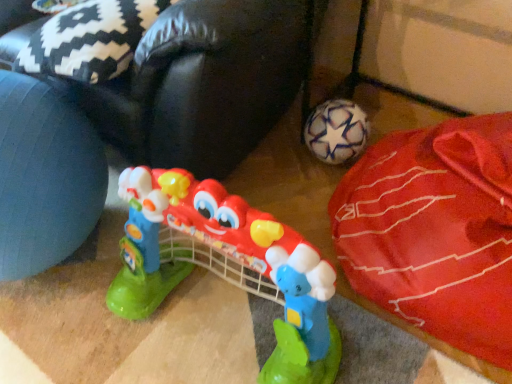
What do you see at coordinates (203, 84) in the screenshot? This screenshot has width=512, height=384. I see `red fabric bean bag at lower right` at bounding box center [203, 84].

Image resolution: width=512 pixels, height=384 pixels. Find the location of `plastic toy guitar at center`. plastic toy guitar at center is located at coordinates [226, 265].

Considering the relative sizes of red fabric bean bag at lower right and white matte soccer ball at lower right in the image provided, is red fabric bean bag at lower right thinner than white matte soccer ball at lower right?

No.

From the image's perspective, which is above, red fabric bean bag at lower right or white matte soccer ball at lower right?

red fabric bean bag at lower right appears higher in the image.

Considering their positions, is red fabric bean bag at lower right located in front of or behind white matte soccer ball at lower right?

Visually, red fabric bean bag at lower right is located behind white matte soccer ball at lower right.

From a real-world perspective, which is physically above, red fabric bean bag at lower right or white matte soccer ball at lower right?

From a 3D spatial view, red fabric bean bag at lower right is above.

The image size is (512, 384). I want to click on bean bag chair above the white matte soccer ball at lower right (from a real-world perspective), so click(203, 84).

Based on their sizes in the image, would you say white matte soccer ball at lower right is bigger or smaller than red fabric bean bag at lower right?

In the image, white matte soccer ball at lower right appears to be smaller than red fabric bean bag at lower right.

What's the angular difference between white matte soccer ball at lower right and red fabric bean bag at lower right's facing directions?

The angular difference between white matte soccer ball at lower right and red fabric bean bag at lower right is 1.96 degrees.

Considering the sizes of white matte soccer ball at lower right and red fabric bean bag at lower right in the image, is white matte soccer ball at lower right wider or thinner than red fabric bean bag at lower right?

Considering their sizes, white matte soccer ball at lower right looks slimmer than red fabric bean bag at lower right.

Based on the photo, from the image's perspective, does plastic toy guitar at center appear lower than red fabric bean bag at lower right?

Yes, from the image's perspective, plastic toy guitar at center is below red fabric bean bag at lower right.

Consider the image. Measure the distance between plastic toy guitar at center and red fabric bean bag at lower right.

plastic toy guitar at center is 13.63 inches from red fabric bean bag at lower right.

Considering the sizes of objects plastic toy guitar at center and red fabric bean bag at lower right in the image provided, who is bigger, plastic toy guitar at center or red fabric bean bag at lower right?

Bigger between the two is red fabric bean bag at lower right.

From a real-world perspective, between plastic toy guitar at center and red fabric bean bag at lower right, who is vertically higher?

red fabric bean bag at lower right, from a real-world perspective.

Is white matte soccer ball at lower right not inside plastic toy guitar at center?

Yes, white matte soccer ball at lower right is located beyond the bounds of plastic toy guitar at center.

Considering the relative sizes of white matte soccer ball at lower right and plastic toy guitar at center in the image provided, is white matte soccer ball at lower right bigger than plastic toy guitar at center?

Correct, white matte soccer ball at lower right is larger in size than plastic toy guitar at center.

Which is in front, white matte soccer ball at lower right or plastic toy guitar at center?

plastic toy guitar at center is more forward.

Between white matte soccer ball at lower right and plastic toy guitar at center, which one appears on the left side from the viewer's perspective?

plastic toy guitar at center.

Between red fabric bean bag at lower right and plastic toy guitar at center, which one appears on the right side from the viewer's perspective?

From the viewer's perspective, plastic toy guitar at center appears more on the right side.

Is point (234, 168) less distant than point (284, 248)?

No, it is not.

Where is `toy in front of the red fabric bean bag at lower right`? toy in front of the red fabric bean bag at lower right is located at coordinates (226, 265).

Is red fabric bean bag at lower right next to plastic toy guitar at center?

There is a gap between red fabric bean bag at lower right and plastic toy guitar at center.

Which of these two, plastic toy guitar at center or white matte soccer ball at lower right, is wider?

Wider between the two is white matte soccer ball at lower right.

Considering the sizes of objects plastic toy guitar at center and white matte soccer ball at lower right in the image provided, who is smaller, plastic toy guitar at center or white matte soccer ball at lower right?

plastic toy guitar at center.

Is plastic toy guitar at center positioned beyond the bounds of white matte soccer ball at lower right?

Yes.

This screenshot has width=512, height=384. I want to click on bean bag chair above the white matte soccer ball at lower right (from a real-world perspective), so click(203, 84).

Locate an element on the screen. material that is in front of the red fabric bean bag at lower right is located at coordinates (435, 231).

Which object lies further to the anchor point red fabric bean bag at lower right, white matte soccer ball at lower right or plastic toy guitar at center?

white matte soccer ball at lower right.

From the image, which object appears to be nearer to red fabric bean bag at lower right, plastic toy guitar at center or white matte soccer ball at lower right?

plastic toy guitar at center is closer to red fabric bean bag at lower right.

In the scene shown: Which object lies further to the anchor point plastic toy guitar at center, white matte soccer ball at lower right or red fabric bean bag at lower right?

Among the two, white matte soccer ball at lower right is located further to plastic toy guitar at center.

Based on their spatial positions, is red fabric bean bag at lower right or plastic toy guitar at center further from white matte soccer ball at lower right?

Based on the image, red fabric bean bag at lower right appears to be further to white matte soccer ball at lower right.

From the image, which object appears to be nearer to white matte soccer ball at lower right, plastic toy guitar at center or red fabric bean bag at lower right?

plastic toy guitar at center.

Estimate the real-world distances between objects in this image. Which object is closer to plastic toy guitar at center, red fabric bean bag at lower right or white matte soccer ball at lower right?

Based on the image, red fabric bean bag at lower right appears to be nearer to plastic toy guitar at center.

Find the location of `toy located between red fabric bean bag at lower right and white matte soccer ball at lower right in the left-right direction`. toy located between red fabric bean bag at lower right and white matte soccer ball at lower right in the left-right direction is located at coordinates (226, 265).